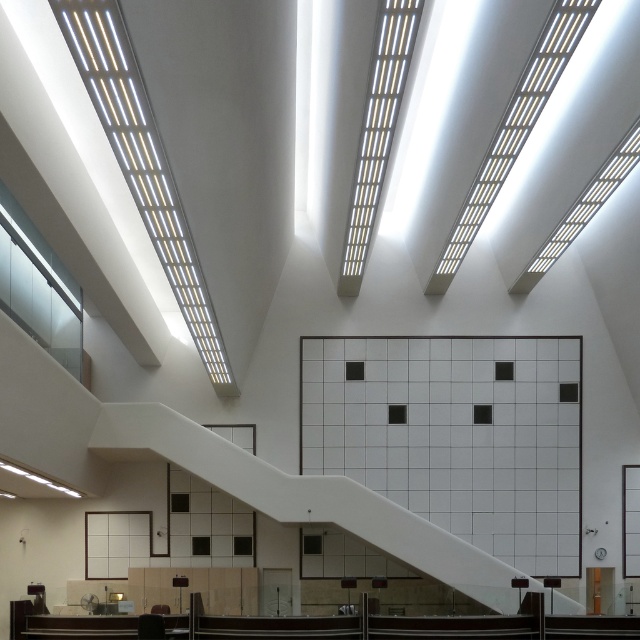
Who is higher up, white tile wall at center or white glossy staircase at center?

white tile wall at center is higher up.

Does white tile wall at center appear under white glossy staircase at center?

No, white tile wall at center is not below white glossy staircase at center.

Where is `white tile wall at center`? white tile wall at center is located at coordinates (456, 435).

You are a GUI agent. You are given a task and a screenshot of the screen. Output one action in this format:
    pyautogui.click(x=<x>, y=<y>)
    Task: Click on the white tile wall at center
    
    Given the screenshot: What is the action you would take?
    pyautogui.click(x=456, y=435)